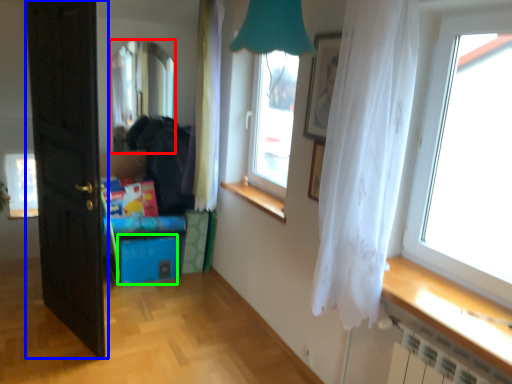
Question: Estimate the real-world distances between objects in this image. Which object is closer to window (highlighted by a red box), door (highlighted by a blue box) or storage box (highlighted by a green box)?

Choices:
 (A) door
 (B) storage box

Answer: (B)